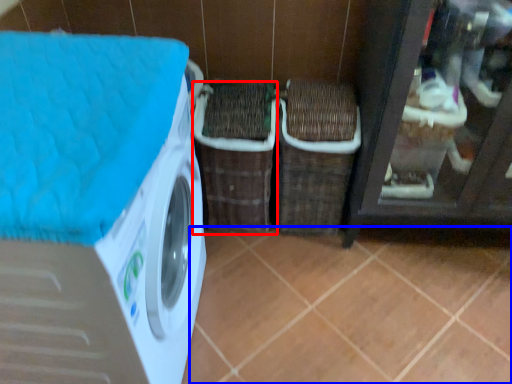
Question: Which object is further to the camera taking this photo, basket (highlighted by a red box) or tile (highlighted by a blue box)?

Choices:
 (A) basket
 (B) tile

Answer: (A)